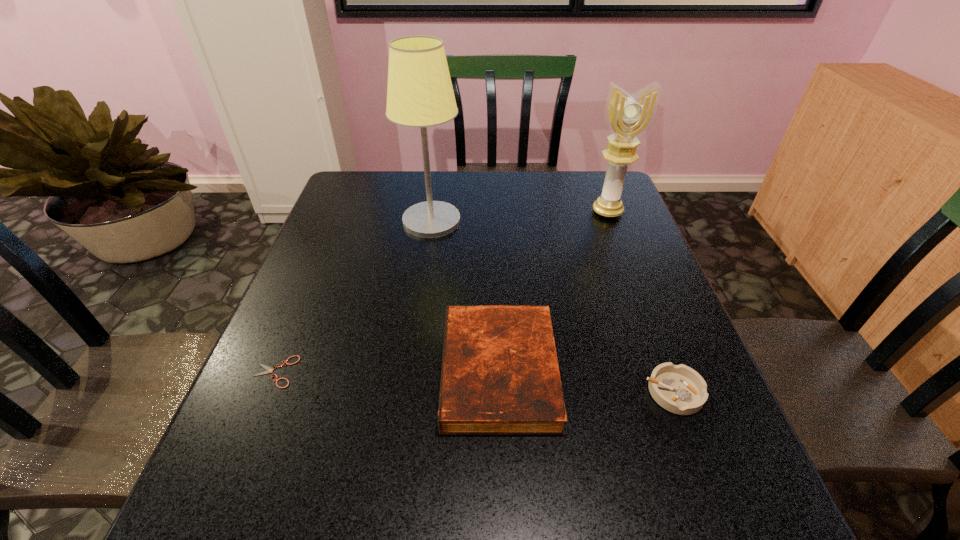
The image size is (960, 540). I want to click on vacant space located on the spine side of the third shortest object, so click(317, 371).

Find the location of a particular element. vacant space situated on the back of the second shortest object is located at coordinates click(625, 264).

Locate an element on the screen. free space located 0.050m on the back of the shortest object is located at coordinates (289, 338).

At what (x,y) coordinates should I click in order to perform the action: click on table lamp at the far edge. Please return your answer as a coordinate pair (x, y). The height and width of the screenshot is (540, 960). Looking at the image, I should click on (419, 94).

Find the location of a particular element. The height and width of the screenshot is (540, 960). award located in the far edge section of the desktop is located at coordinates (628, 116).

At what (x,y) coordinates should I click in order to perform the action: click on object present at the left edge. Please return your answer as a coordinate pair (x, y). Looking at the image, I should click on (269, 370).

The image size is (960, 540). Identify the location of award at the right edge. (628, 116).

Identify the location of ashtray that is positioned at the right edge. (679, 389).

This screenshot has height=540, width=960. Identify the location of object that is at the far right corner. (628, 116).

In the image, there is a desktop. Where is `vacant space at the far edge`? vacant space at the far edge is located at coordinates (532, 172).